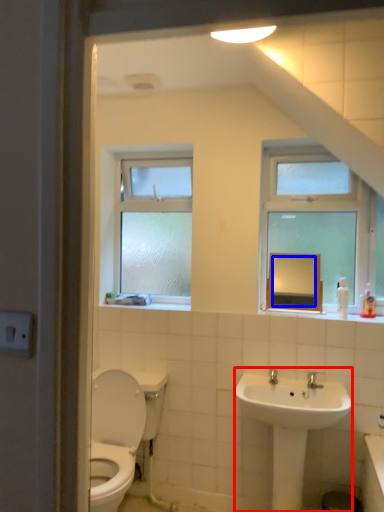
Question: Which point is further to the camera, sink (highlighted by a red box) or mirror (highlighted by a blue box)?

Choices:
 (A) sink
 (B) mirror

Answer: (B)